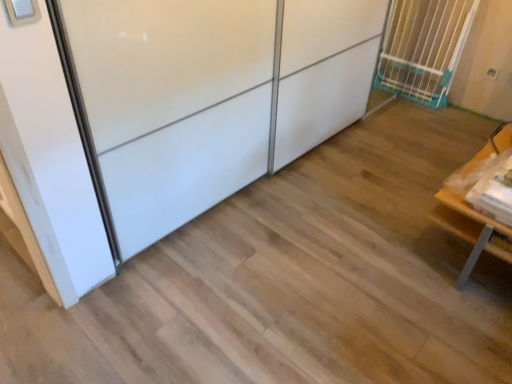
Question: From the image's perspective, is white plastic gate at upper right above wooden table at right?

Choices:
 (A) no
 (B) yes

Answer: (B)

Question: Does white plastic gate at upper right have a lesser height compared to wooden table at right?

Choices:
 (A) yes
 (B) no

Answer: (B)

Question: Could you tell me if white plastic gate at upper right is facing wooden table at right?

Choices:
 (A) yes
 (B) no

Answer: (B)

Question: From a real-world perspective, is white plastic gate at upper right below wooden table at right?

Choices:
 (A) no
 (B) yes

Answer: (A)

Question: Is white plastic gate at upper right far from wooden table at right?

Choices:
 (A) yes
 (B) no

Answer: (A)

Question: Is white plastic gate at upper right positioned behind wooden table at right?

Choices:
 (A) no
 (B) yes

Answer: (B)

Question: Does white glossy sliding door at upper left lie in front of white plastic gate at upper right?

Choices:
 (A) no
 (B) yes

Answer: (B)

Question: Considering the relative positions of white glossy sliding door at upper left and white plastic gate at upper right in the image provided, is white glossy sliding door at upper left behind white plastic gate at upper right?

Choices:
 (A) yes
 (B) no

Answer: (B)

Question: Is white glossy sliding door at upper left located outside white plastic gate at upper right?

Choices:
 (A) no
 (B) yes

Answer: (B)

Question: Would you say white glossy sliding door at upper left is a long distance from white plastic gate at upper right?

Choices:
 (A) no
 (B) yes

Answer: (B)

Question: Can you confirm if white glossy sliding door at upper left is positioned to the left of white plastic gate at upper right?

Choices:
 (A) yes
 (B) no

Answer: (A)

Question: Considering the relative sizes of white glossy sliding door at upper left and white plastic gate at upper right in the image provided, is white glossy sliding door at upper left taller than white plastic gate at upper right?

Choices:
 (A) yes
 (B) no

Answer: (A)

Question: Is the depth of wooden table at right greater than that of white glossy sliding door at upper left?

Choices:
 (A) no
 (B) yes

Answer: (B)